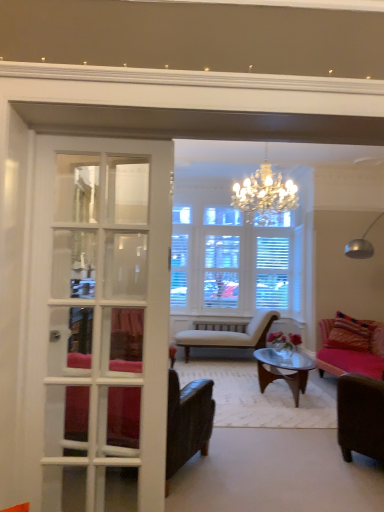
At what (x,y) coordinates should I click in order to perform the action: click on free spot above white glass door at left (from a real-world perspective). Please return your answer as a coordinate pair (x, y). Image resolution: width=384 pixels, height=512 pixels. Looking at the image, I should click on (106, 133).